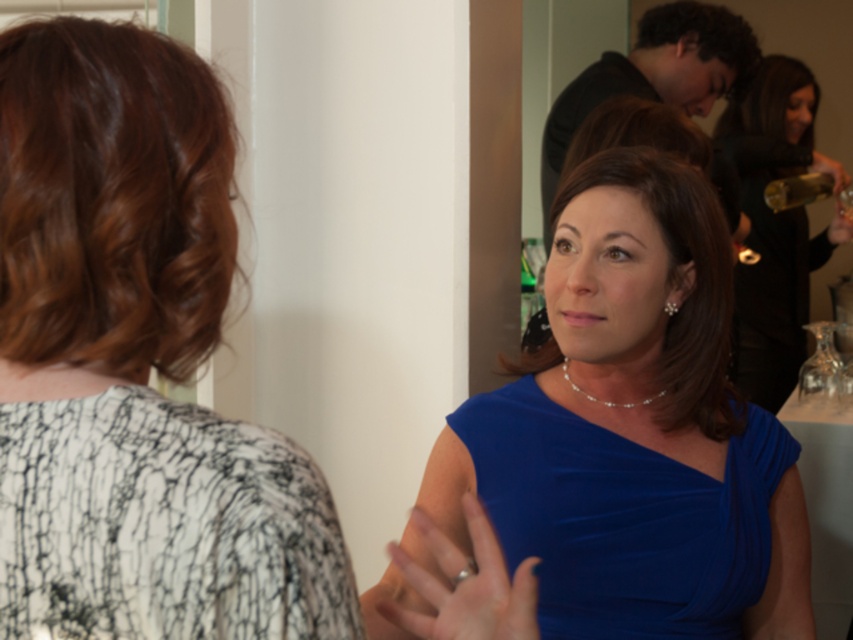
Question: Which point appears closest to the camera in this image?

Choices:
 (A) (15, 472)
 (B) (675, 305)
 (C) (167, 621)

Answer: (C)

Question: Can you confirm if blue velvet dress at center is positioned to the right of satin blue dress at center?

Choices:
 (A) no
 (B) yes

Answer: (A)

Question: From the image, what is the correct spatial relationship of satin blue dress at center in relation to blue satin dress at center?

Choices:
 (A) left
 (B) right

Answer: (A)

Question: Which point is closer to the camera?

Choices:
 (A) (373, 621)
 (B) (136, 426)

Answer: (B)

Question: Observing the image, what is the correct spatial positioning of white lace blouse at upper left in reference to satin blue dress at center?

Choices:
 (A) right
 (B) left

Answer: (B)

Question: Estimate the real-world distances between objects in this image. Which object is closer to the blue satin dress at center?

Choices:
 (A) white textured dress at upper left
 (B) white lace blouse at upper left

Answer: (B)